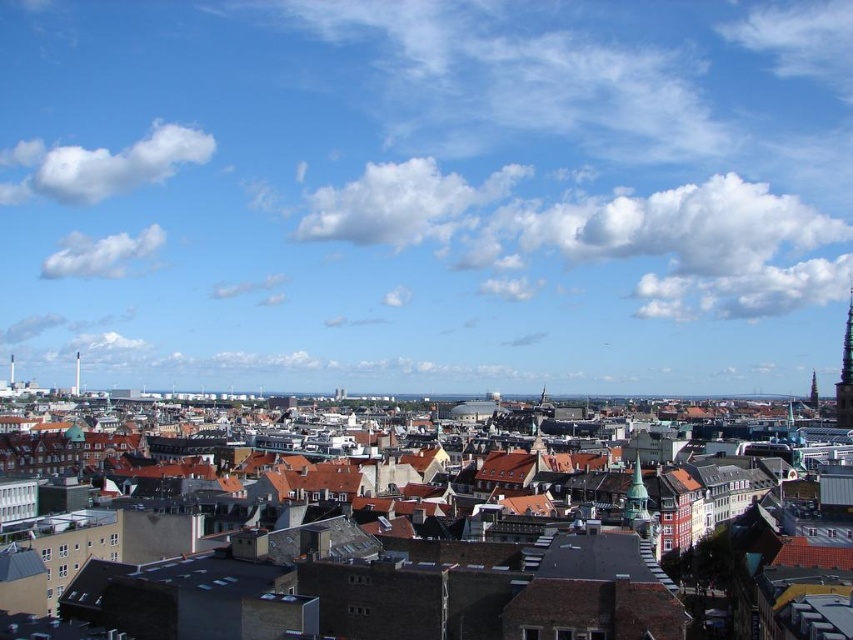
Can you confirm if green metallic tower at center is positioned above dark gray stone tower at upper right?

Actually, green metallic tower at center is below dark gray stone tower at upper right.

Can you confirm if green metallic tower at center is positioned to the left of dark gray stone tower at upper right?

Indeed, green metallic tower at center is positioned on the left side of dark gray stone tower at upper right.

Which is behind, point (641, 477) or point (846, 355)?

Point (846, 355)

I want to click on green metallic tower at center, so click(637, 504).